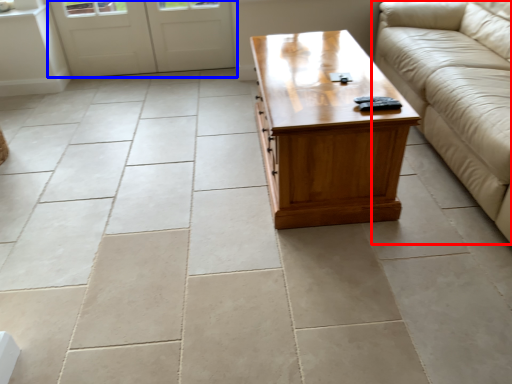
Question: Which of the following is the farthest to the observer, studio couch (highlighted by a red box) or door (highlighted by a blue box)?

Choices:
 (A) studio couch
 (B) door

Answer: (B)